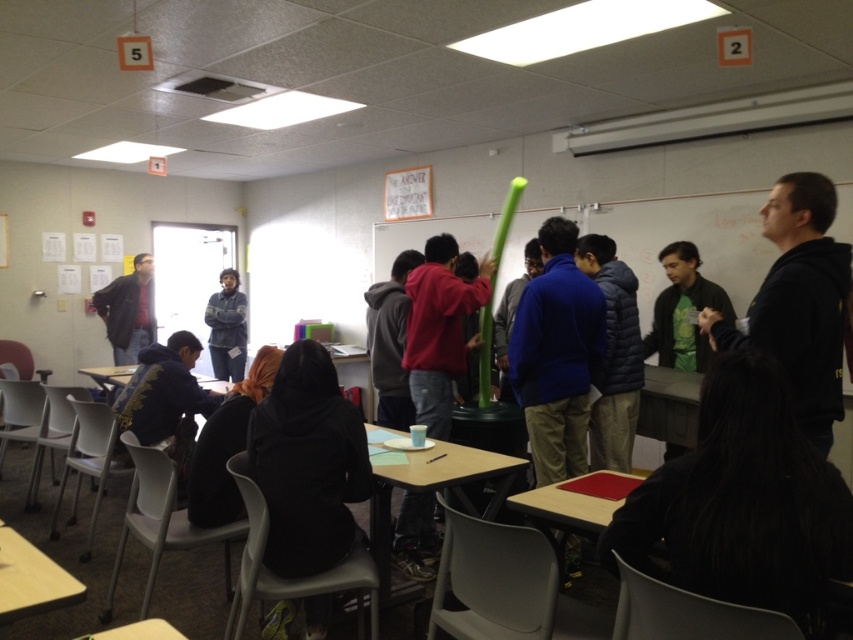
Question: Does wooden table at center have a larger size compared to wooden table at lower center?

Choices:
 (A) yes
 (B) no

Answer: (A)

Question: From the image, what is the correct spatial relationship of green foam pole at center in relation to black hoodie at right?

Choices:
 (A) right
 (B) left

Answer: (B)

Question: Which point is closer to the camera?

Choices:
 (A) (802, 403)
 (B) (207, 321)
 (C) (430, 474)

Answer: (A)

Question: Considering the real-world distances, which object is closest to the wooden table at lower left?

Choices:
 (A) wooden table at lower center
 (B) denim jacket at left

Answer: (A)

Question: Which point is closer to the camera?

Choices:
 (A) (386, 557)
 (B) (120, 371)
 (C) (833, 321)

Answer: (C)

Question: Does black hoodie at right appear on the right side of wooden table at center?

Choices:
 (A) no
 (B) yes

Answer: (B)